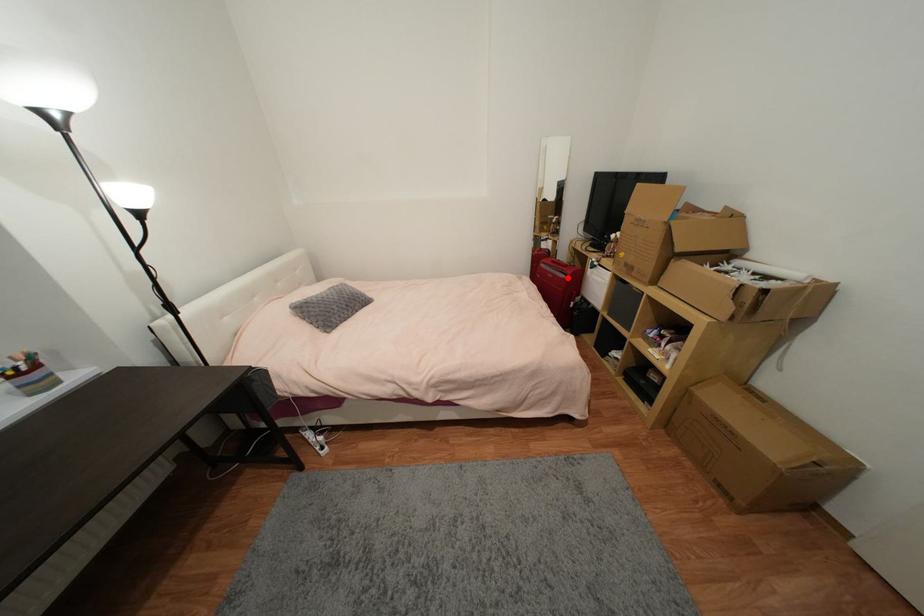
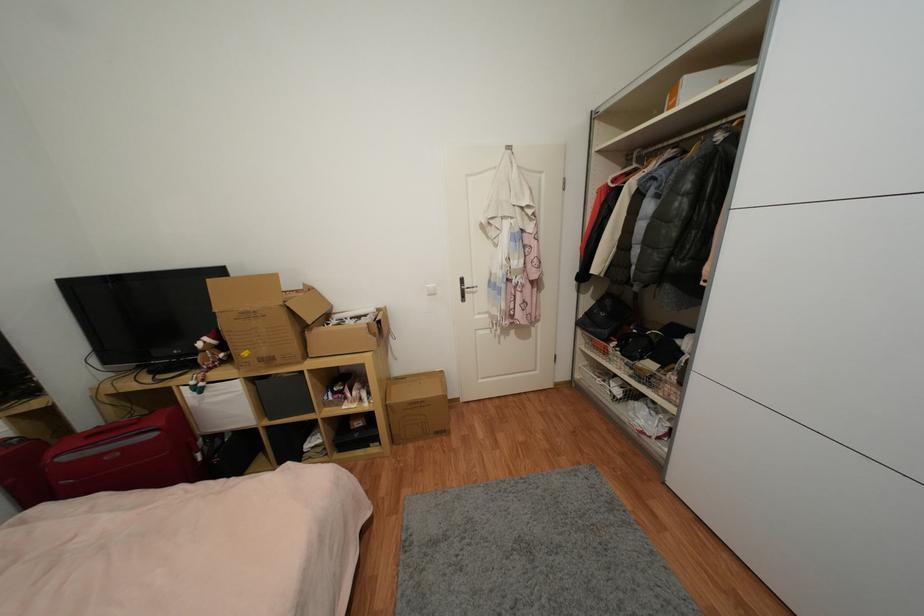
Question: I am providing you with two images of the same scene from different viewpoints. A red point is marked on the first image. Can you still see the location of the red point in image 2?

Choices:
 (A) Yes
 (B) No

Answer: (A)